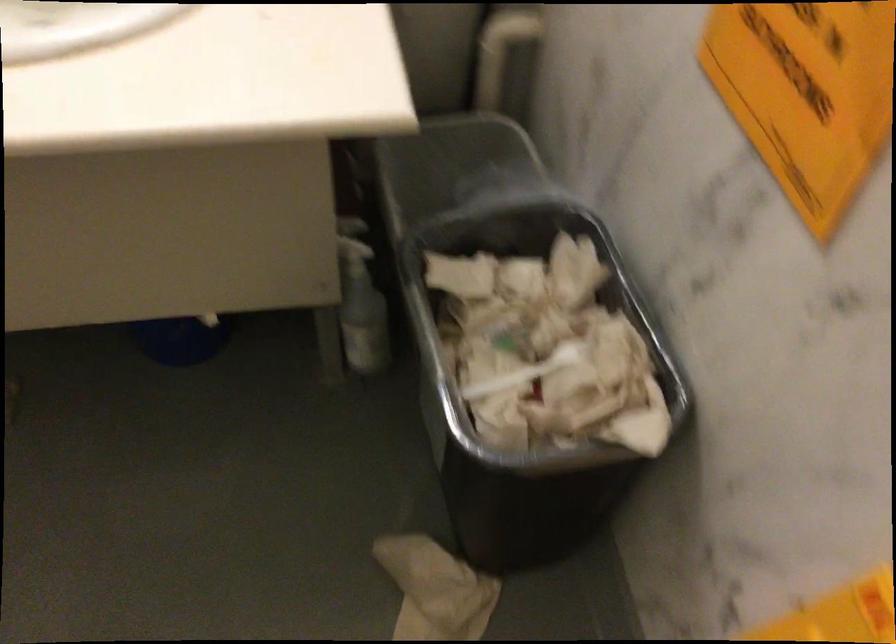
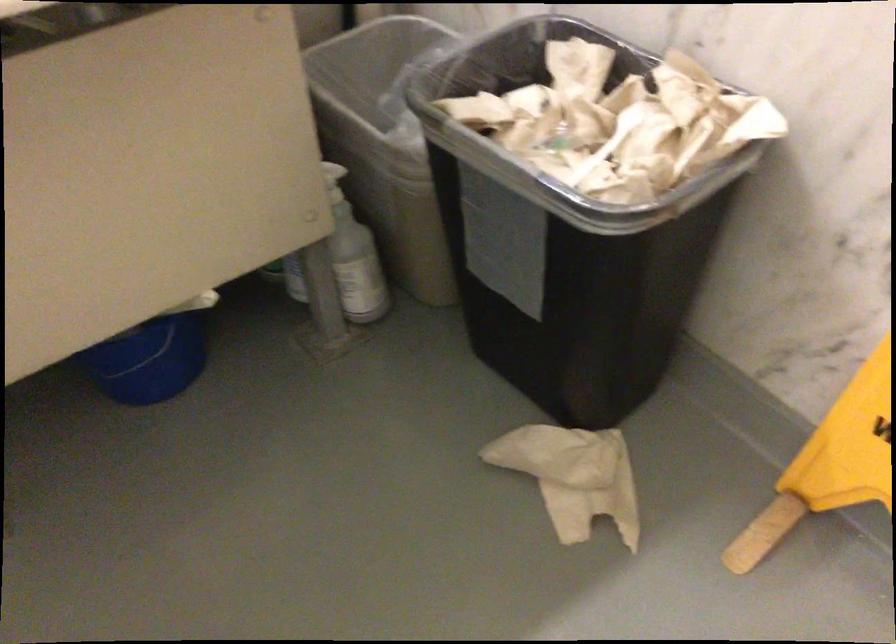
The point at (157, 335) is marked in the first image. Where is the corresponding point in the second image?

(149, 361)